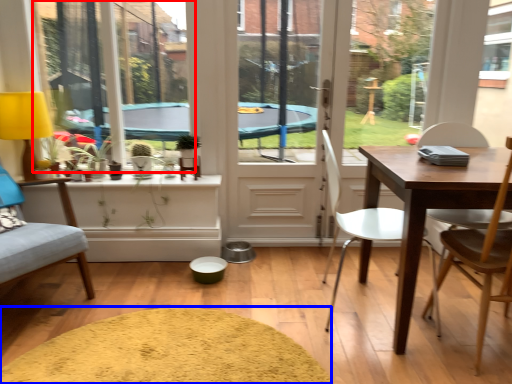
Question: Among these objects, which one is nearest to the camera, window screen (highlighted by a red box) or wide (highlighted by a blue box)?

Choices:
 (A) window screen
 (B) wide

Answer: (B)